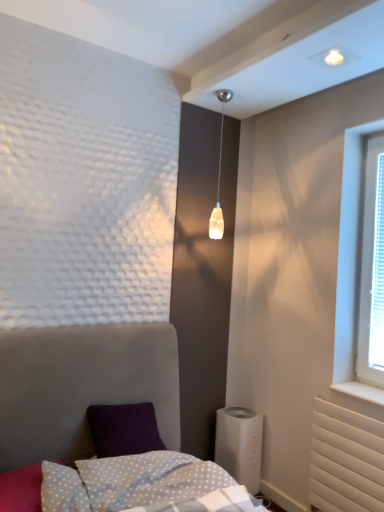
Question: Is white dotted fabric at lower center smaller than translucent glass pendant light at upper center?

Choices:
 (A) no
 (B) yes

Answer: (A)

Question: Could translucent glass pendant light at upper center be considered to be inside white dotted fabric at lower center?

Choices:
 (A) no
 (B) yes

Answer: (A)

Question: Is white dotted fabric at lower center facing towards translucent glass pendant light at upper center?

Choices:
 (A) yes
 (B) no

Answer: (B)

Question: From a real-world perspective, is white dotted fabric at lower center below translucent glass pendant light at upper center?

Choices:
 (A) yes
 (B) no

Answer: (A)

Question: Is the position of white dotted fabric at lower center less distant than that of translucent glass pendant light at upper center?

Choices:
 (A) yes
 (B) no

Answer: (A)

Question: From the image's perspective, is white dotted fabric at lower center located beneath translucent glass pendant light at upper center?

Choices:
 (A) yes
 (B) no

Answer: (A)

Question: Considering the relative positions of white plastic blinds at right and translucent glass pendant light at upper center in the image provided, is white plastic blinds at right to the left of translucent glass pendant light at upper center from the viewer's perspective?

Choices:
 (A) no
 (B) yes

Answer: (A)

Question: Can you see white plastic blinds at right touching translucent glass pendant light at upper center?

Choices:
 (A) yes
 (B) no

Answer: (B)

Question: Is white plastic blinds at right taller than translucent glass pendant light at upper center?

Choices:
 (A) yes
 (B) no

Answer: (A)

Question: Does white plastic blinds at right lie in front of translucent glass pendant light at upper center?

Choices:
 (A) yes
 (B) no

Answer: (A)

Question: Is white plastic blinds at right positioned with its back to translucent glass pendant light at upper center?

Choices:
 (A) no
 (B) yes

Answer: (A)

Question: From a real-world perspective, is white plastic blinds at right under translucent glass pendant light at upper center?

Choices:
 (A) no
 (B) yes

Answer: (B)

Question: Is velvet grey bed at lower left at the back of white dotted fabric at lower center?

Choices:
 (A) no
 (B) yes

Answer: (B)